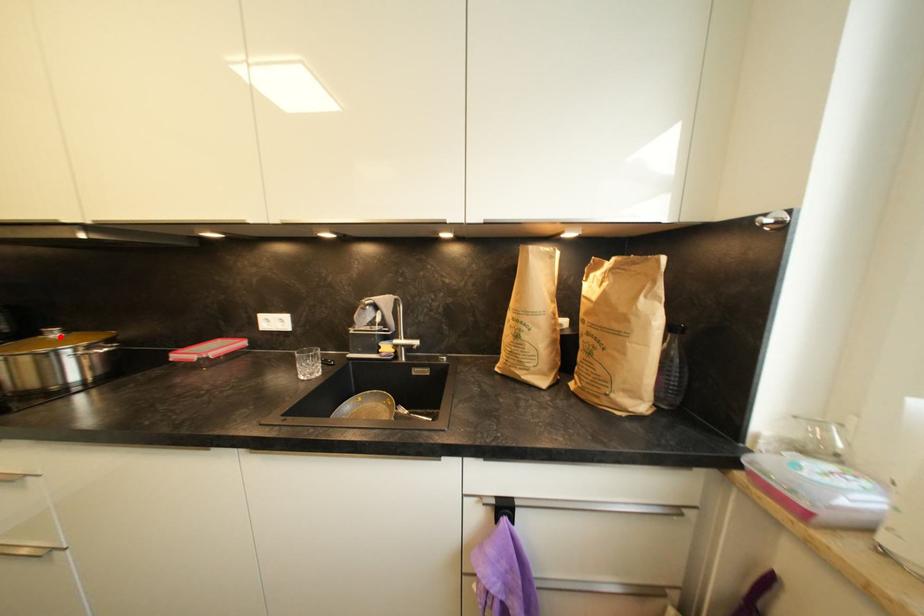
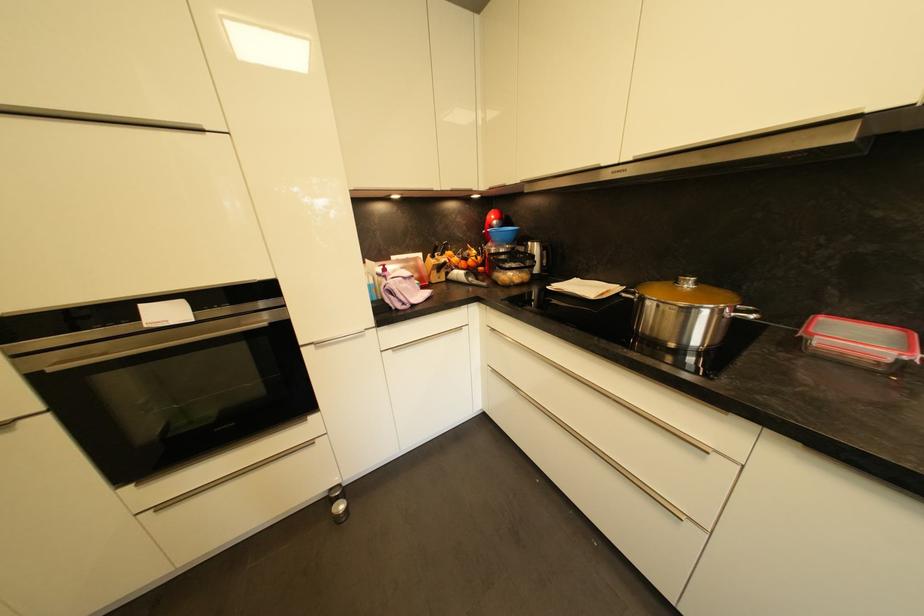
Locate, in the second image, the point that corresponds to the highlighted location in the first image.

(694, 286)